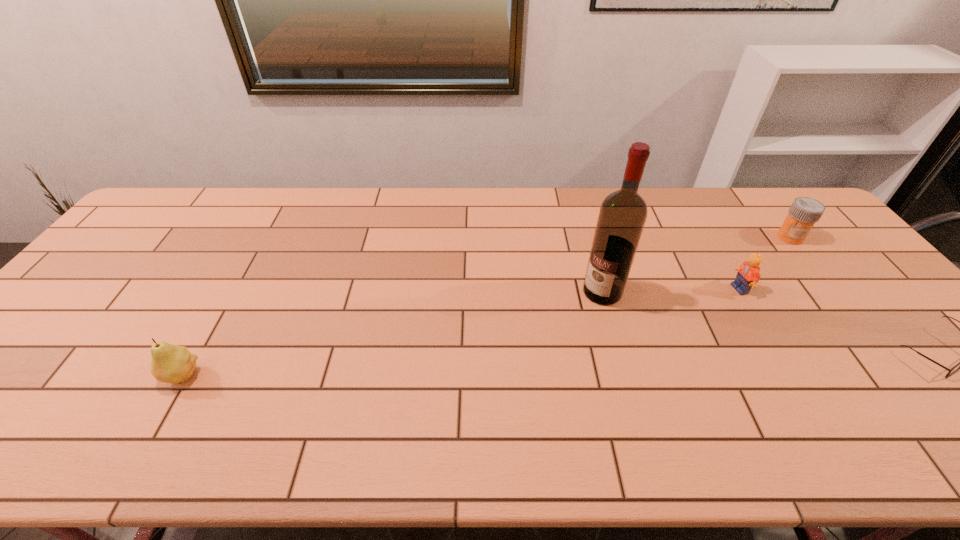
Where is `free space located on the label side of the farthest object`? The image size is (960, 540). free space located on the label side of the farthest object is located at coordinates (778, 250).

Locate an element on the screen. The image size is (960, 540). vacant space situated on the label side of the farthest object is located at coordinates (732, 296).

You are a GUI agent. You are given a task and a screenshot of the screen. Output one action in this format:
    pyautogui.click(x=<x>, y=<y>)
    Task: Click on the free space located on the front and back of the tallest object
    Image resolution: width=960 pixels, height=540 pixels.
    Given the screenshot: What is the action you would take?
    pyautogui.click(x=529, y=359)

The height and width of the screenshot is (540, 960). I want to click on vacant region located 0.120m on the front and back of the tallest object, so click(x=564, y=327).

Locate an element on the screen. free spot located 0.360m on the front and back of the tallest object is located at coordinates (501, 385).

Locate an element on the screen. Image resolution: width=960 pixels, height=540 pixels. object that is at the near edge is located at coordinates click(x=173, y=364).

The width and height of the screenshot is (960, 540). I want to click on object that is at the right edge, so click(x=804, y=212).

I want to click on vacant space at the far edge, so click(757, 207).

Identify the location of vacant region at the near edge. (259, 408).

At what (x,y) coordinates should I click in order to perform the action: click on vacant area at the left edge. Please return your answer as a coordinate pair (x, y). The width and height of the screenshot is (960, 540). Looking at the image, I should click on (88, 301).